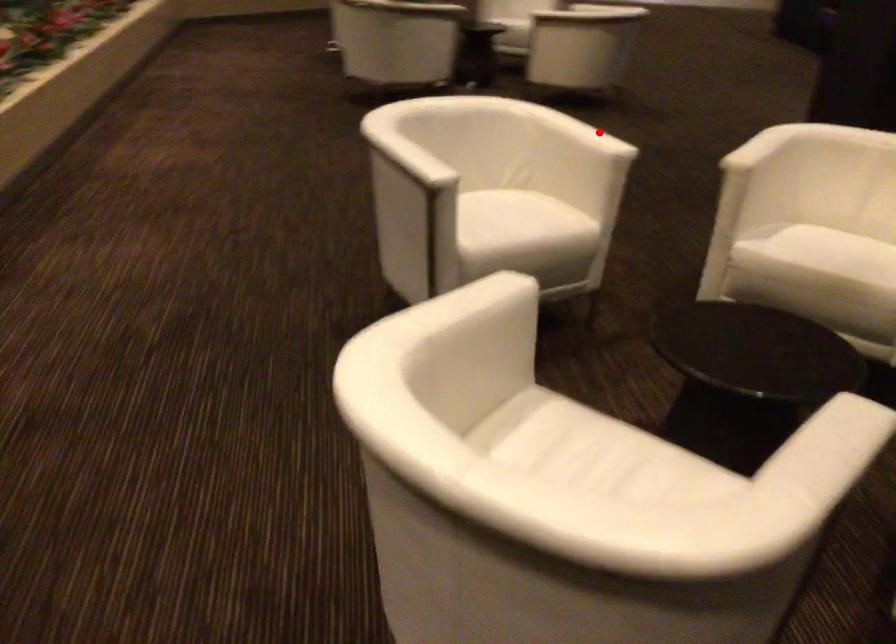
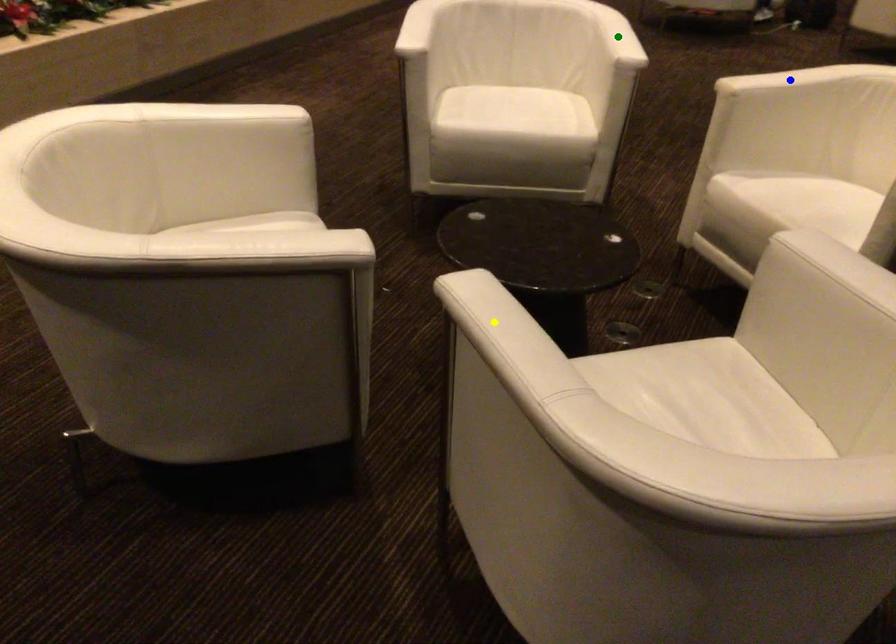
Question: I am providing you with two images of the same scene from different viewpoints. A red point is marked on the first image. You are given multiple points on the second image. In image 2, which mark is for the same physical point as the one in image 1?

Choices:
 (A) blue point
 (B) yellow point
 (C) green point

Answer: (C)